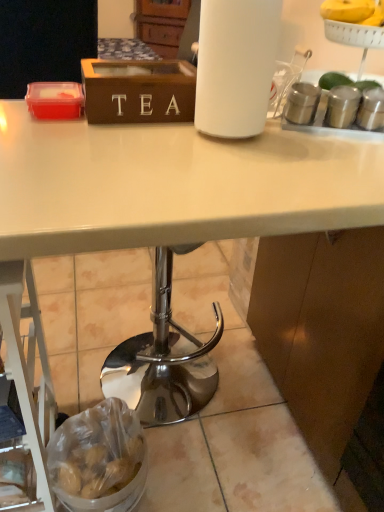
In order to click on vacant space to the right of translucent plastic bag of potatoes at lower left in this screenshot , I will do `click(193, 468)`.